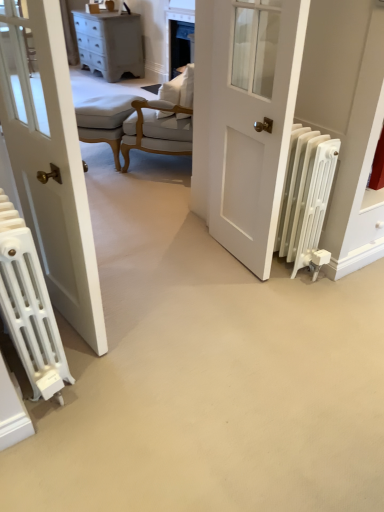
Find the location of a particular element. The width and height of the screenshot is (384, 512). empty space that is in between white matte radiator at lower left, the second radiator viewed from the right, and white matte radiator at right, which is the second radiator in left-to-right order is located at coordinates (173, 312).